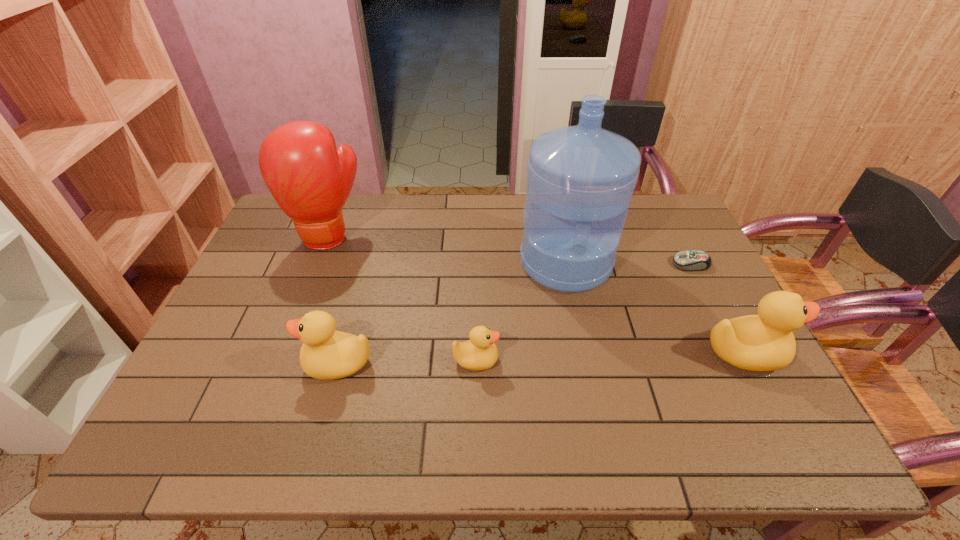
To ensure equal spacing by inserting another duck among them, please point out a vacant spot for this new duck. Please provide its 2D coordinates. Your answer should be formatted as a tuple, i.e. [(x, y)], where the tuple contains the x and y coordinates of a point satisfying the conditions above.

[(611, 356)]